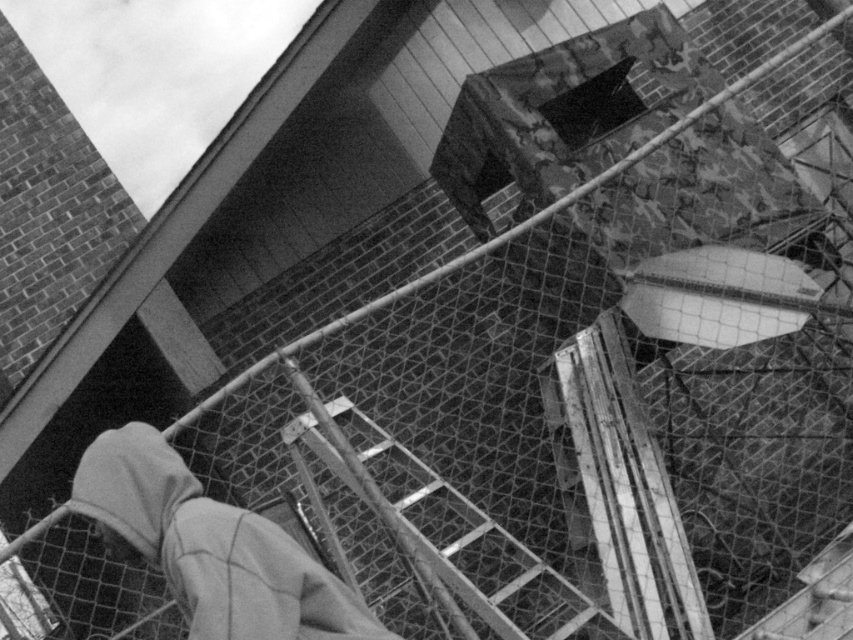
You are standing at the bottom of the image and want to locate the gray fleece hoodie at lower left. Based on the coordinates provided, where exactly would you find it?

The gray fleece hoodie at lower left is located at the 2D coordinates point (212, 547).

You are standing at the base of the ladder in the image. Looking up, you see the metallic silver ladder at center and the gray fleece hoodie at lower left. Which object is closer to your current position?

The gray fleece hoodie at lower left is closer to your current position because it is below the metallic silver ladder at center, meaning it is situated lower in the scene.

In the image, you see a metallic silver ladder at center and a wooden at center. Which object is positioned to the right side?

The metallic silver ladder at center is to the right of the wooden at center.